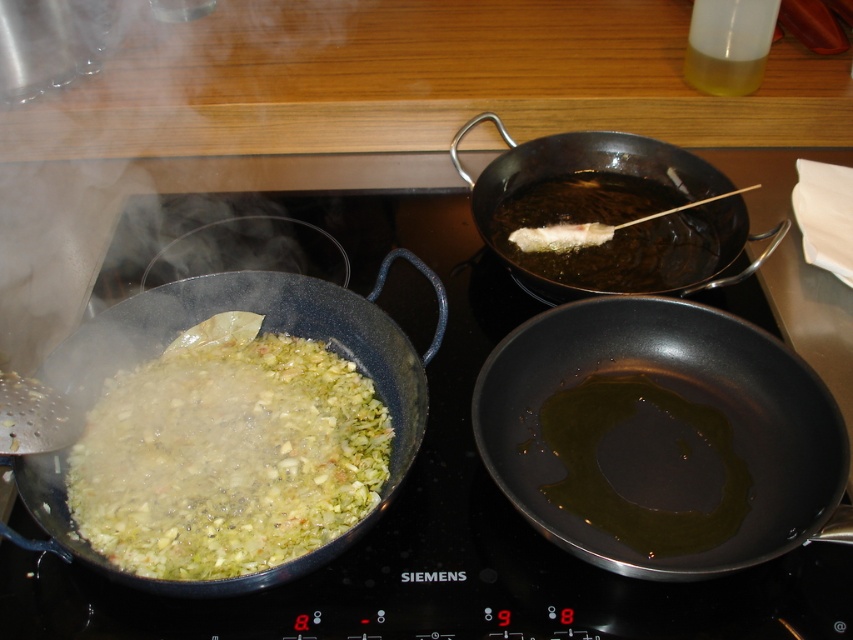
You are a chef preparing a stir fry and need to move the shiny black wok at lower left to the shiny black pan at lower right. Can you lift the wok directly over the pan without moving the pan first?

The shiny black pan at lower right is positioned under the shiny black wok at lower left, so you can lift the wok directly over the pan without needing to move the pan first.

You are standing in front of the Siemens induction cooktop and need to reach the point at coordinates point (108, 326) and point (596, 285). Which point should you reach first if you want to touch them in the order they appear from closest to farthest from you?

You should reach point (108, 326) first because it is closer to you than point (596, 285), which is further away.

From the picture: You are a chef preparing a stir fry and need to choose between the shiny black pan at lower right and the shiny black wok at upper right. Which one should you use if you want a larger cooking surface?

The shiny black wok at upper right is larger than the shiny black pan at lower right, so you should use the shiny black wok at upper right for a larger cooking surface.